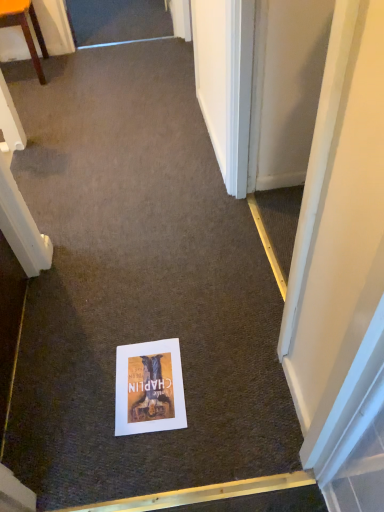
Question: From a real-world perspective, is wooden chair at upper left physically located above or below matte paper poster at center?

Choices:
 (A) above
 (B) below

Answer: (A)

Question: Does point (44, 78) appear closer or farther from the camera than point (125, 348)?

Choices:
 (A) farther
 (B) closer

Answer: (A)

Question: In terms of height, does wooden chair at upper left look taller or shorter compared to matte paper poster at center?

Choices:
 (A) tall
 (B) short

Answer: (A)

Question: From the image's perspective, is matte paper poster at center located above or below wooden chair at upper left?

Choices:
 (A) above
 (B) below

Answer: (B)

Question: Visually, is matte paper poster at center positioned to the left or to the right of wooden chair at upper left?

Choices:
 (A) right
 (B) left

Answer: (A)

Question: Would you say matte paper poster at center is inside or outside wooden chair at upper left?

Choices:
 (A) outside
 (B) inside

Answer: (A)

Question: Considering the positions of matte paper poster at center and wooden chair at upper left in the image, is matte paper poster at center bigger or smaller than wooden chair at upper left?

Choices:
 (A) small
 (B) big

Answer: (A)